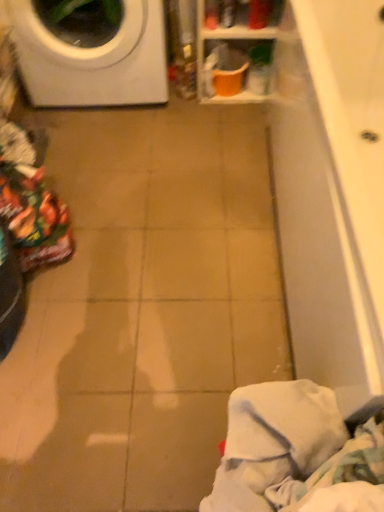
Question: Visually, is white soft cloth at lower right positioned to the left or to the right of white glossy washing machine at upper left?

Choices:
 (A) left
 (B) right

Answer: (B)

Question: In terms of width, does white soft cloth at lower right look wider or thinner when compared to white glossy washing machine at upper left?

Choices:
 (A) thin
 (B) wide

Answer: (A)

Question: Which object is the closest to the orange plastic bucket at upper center?

Choices:
 (A) white glossy washing machine at upper left
 (B) white soft cloth at lower right

Answer: (A)

Question: Which is nearer to the orange plastic bucket at upper center?

Choices:
 (A) white glossy washing machine at upper left
 (B) white soft cloth at lower right

Answer: (A)